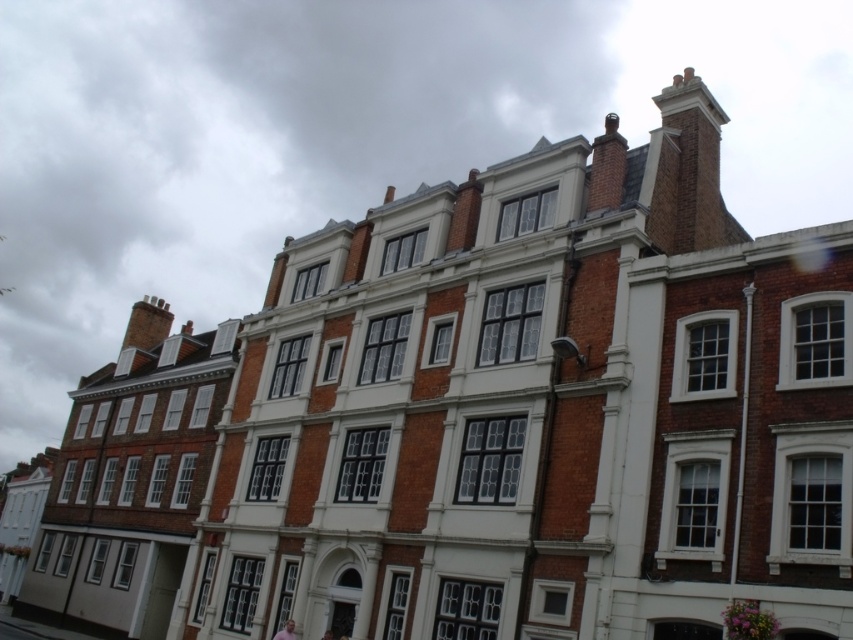
Question: Can you confirm if pink fabric at center is smaller than pink fabric at lower center?

Choices:
 (A) no
 (B) yes

Answer: (A)

Question: Does pink fabric at center have a larger size compared to pink fabric at lower center?

Choices:
 (A) no
 (B) yes

Answer: (B)

Question: Can you confirm if pink fabric at center is positioned above pink fabric at lower center?

Choices:
 (A) yes
 (B) no

Answer: (A)

Question: Which point is farther to the camera?

Choices:
 (A) pink fabric at center
 (B) pink fabric at lower center

Answer: (A)